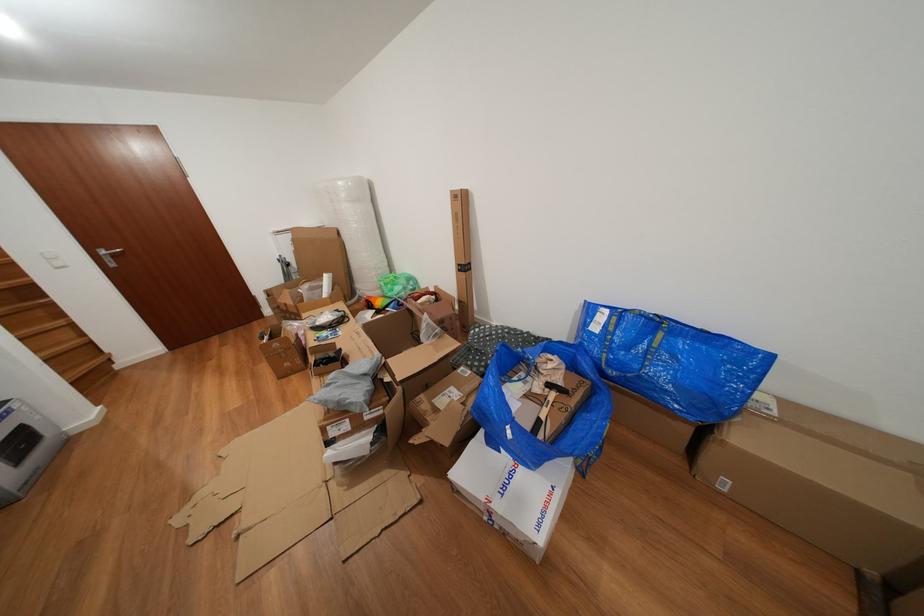
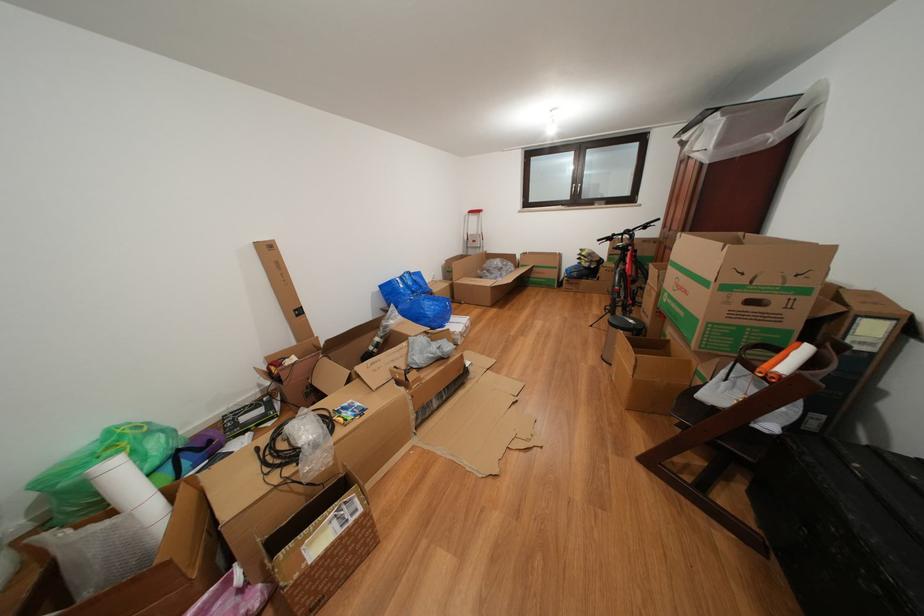
Find the pixel in the second image that matches pixel 602 334 in the first image.

(409, 291)